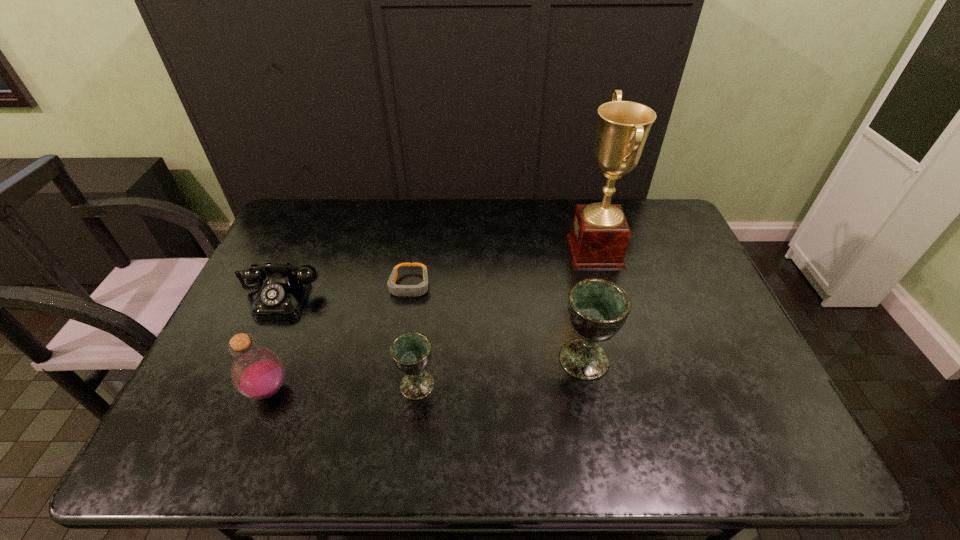
Locate an element on the screen. This screenshot has width=960, height=540. free spot between the telephone and the bottle is located at coordinates (275, 343).

This screenshot has width=960, height=540. Find the location of `free space between the fourth shortest object and the tallest object`. free space between the fourth shortest object and the tallest object is located at coordinates (432, 321).

The image size is (960, 540). I want to click on empty space that is in between the right chalice and the left chalice, so click(x=500, y=372).

Identify the location of empty space that is in between the second shortest object and the taller chalice. The height and width of the screenshot is (540, 960). (433, 328).

Where is `free space that is in between the fifth tallest object and the left chalice`? The width and height of the screenshot is (960, 540). free space that is in between the fifth tallest object and the left chalice is located at coordinates (349, 341).

The width and height of the screenshot is (960, 540). Identify the location of the fourth closest object relative to the shortest object. (597, 308).

The image size is (960, 540). In order to click on object that is the fourth closest to the goggles in this screenshot , I will do `click(597, 308)`.

You are a GUI agent. You are given a task and a screenshot of the screen. Output one action in this format:
    pyautogui.click(x=<x>, y=<y>)
    Task: Click on the vacant space that satisfies the following two spatial constraints: 1. on the plaque of the tallest object; 2. on the front and back of the shortest object
    
    Given the screenshot: What is the action you would take?
    pyautogui.click(x=605, y=285)

Locate an element on the screen. The width and height of the screenshot is (960, 540). vacant space that satisfies the following two spatial constraints: 1. on the back side of the fourth tallest object; 2. on the right side of the fourth shortest object is located at coordinates (270, 385).

Locate an element on the screen. Image resolution: width=960 pixels, height=540 pixels. vacant area that satisfies the following two spatial constraints: 1. on the dial of the telephone; 2. on the right side of the taller chalice is located at coordinates (253, 359).